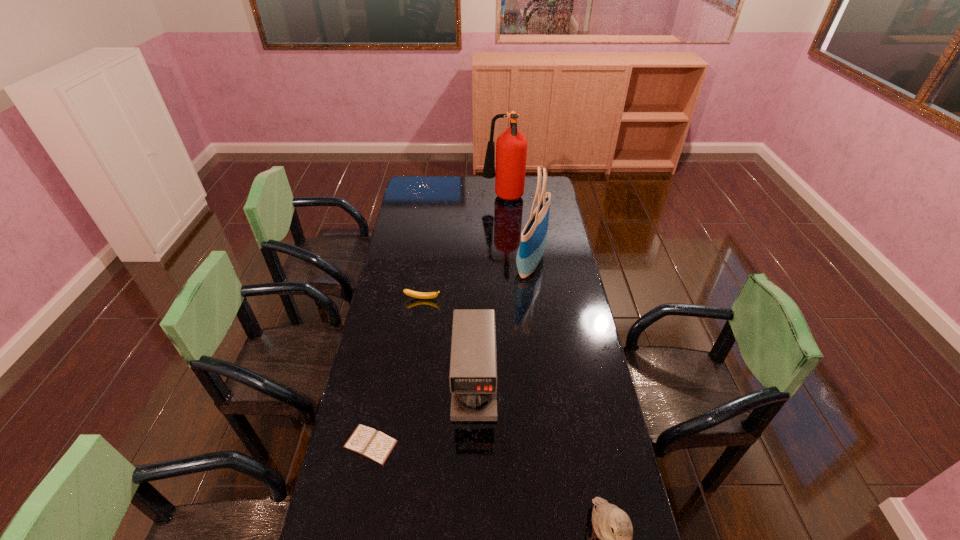
Find the location of a particular element. Image resolution: width=960 pixels, height=540 pixels. free location that satisfies the following two spatial constraints: 1. at the nozzle of the farthest object; 2. on the right side of the tote bag is located at coordinates (508, 264).

This screenshot has height=540, width=960. Find the location of `vacant region that satisfies the following two spatial constraints: 1. at the nozzle of the farthest object; 2. at the stem of the third farthest object`. vacant region that satisfies the following two spatial constraints: 1. at the nozzle of the farthest object; 2. at the stem of the third farthest object is located at coordinates (510, 299).

Image resolution: width=960 pixels, height=540 pixels. Find the location of `vacant position in the image that satisfies the following two spatial constraints: 1. at the nozzle of the farthest object; 2. at the stem of the banana`. vacant position in the image that satisfies the following two spatial constraints: 1. at the nozzle of the farthest object; 2. at the stem of the banana is located at coordinates (510, 299).